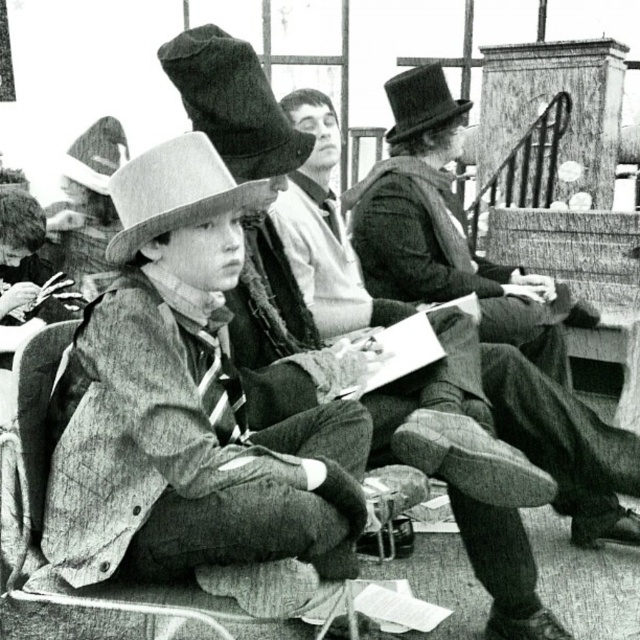
You are standing in the scene and want to pick up the smooth wool coat at center. Where exactly should you look to find it?

→ The smooth wool coat at center is located at the coordinates point (448, 230).

You are a photographer setting up equipment in this historical reenactment scene. You need to place a camera stand that requires 4 feet of space between the smooth black coat at center and the wooden chair at center. Based on the scene, is the current distance sufficient for your setup?

The distance between the smooth black coat at center and the wooden chair at center is 3.71 feet, which is less than the required 4 feet. Therefore, the current distance is insufficient for the camera stand setup.

You are standing in the scene and want to place a small flag at the closest point to you between point (211,40) and point (108,164). Which point should you choose?

Point (211,40) is closer to the viewer than point (108,164), so you should choose point (211,40) to place the flag.